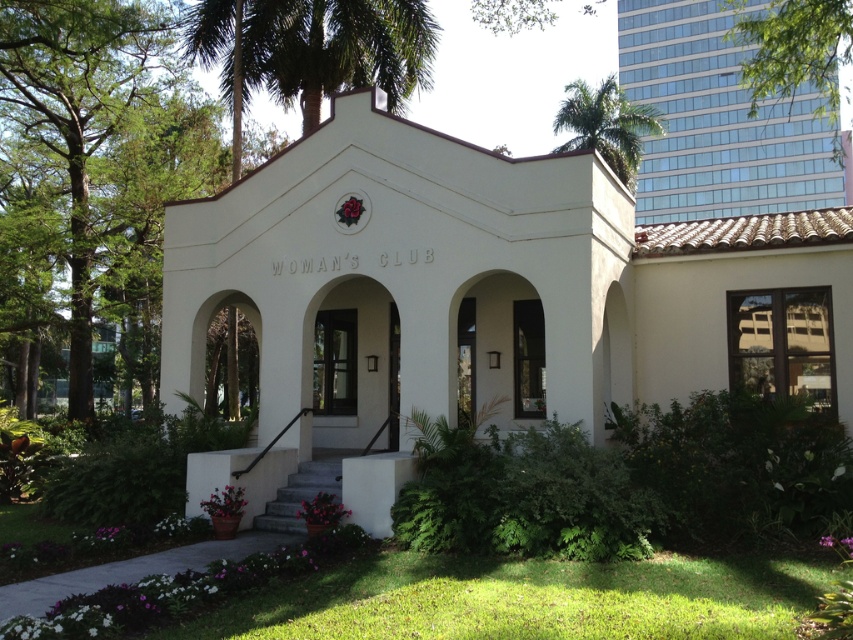
Question: Considering the real-world distances, which object is farthest from the glassy steel skyscraper at upper right?

Choices:
 (A) white stucco chapel at center
 (B) green leafy palm tree at upper center
 (C) green leafy palm tree at upper right

Answer: (B)

Question: Can you confirm if white stucco chapel at center is positioned to the left of green leafy palm tree at upper center?

Choices:
 (A) yes
 (B) no

Answer: (B)

Question: Does green leafy tree at upper right come behind green leafy palm tree at upper right?

Choices:
 (A) yes
 (B) no

Answer: (B)

Question: Is glassy steel skyscraper at upper right thinner than green leafy palm tree at upper center?

Choices:
 (A) no
 (B) yes

Answer: (A)

Question: Which is nearer to the glassy steel skyscraper at upper right?

Choices:
 (A) green leafy palm tree at upper right
 (B) green leafy palm tree at upper center

Answer: (A)

Question: Among these objects, which one is farthest from the camera?

Choices:
 (A) green leafy palm tree at upper center
 (B) green leafy palm tree at upper right

Answer: (B)